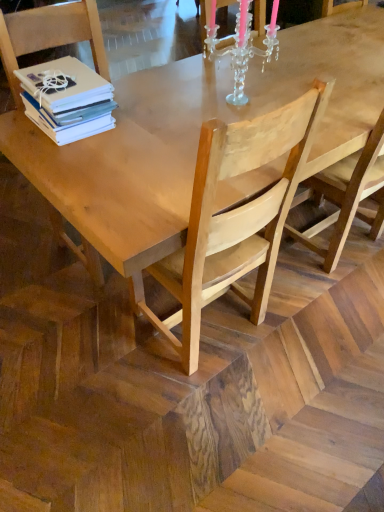
The image size is (384, 512). What do you see at coordinates (236, 216) in the screenshot? I see `light brown wooden chair at center, acting as the 2th chair starting from the left` at bounding box center [236, 216].

What are the coordinates of `light brown wooden chair at center, acting as the 2th chair starting from the left` in the screenshot? It's located at (236, 216).

Measure the distance between point (x=84, y=35) and camera.

They are 1.76 meters apart.

Measure the distance between point (243, 63) and camera.

The depth of point (243, 63) is 6.15 feet.

What is the approximate height of clear crystal candle holder at upper center?

clear crystal candle holder at upper center is 15.81 inches in height.

Where is `light brown wooden chair at center, acting as the 2th chair starting from the left`? light brown wooden chair at center, acting as the 2th chair starting from the left is located at coordinates (236, 216).

Considering the sizes of objects clear crystal candle holder at upper center and light brown wood chair at left, arranged as the 1th chair when viewed from the left, in the image provided, who is smaller, clear crystal candle holder at upper center or light brown wood chair at left, arranged as the 1th chair when viewed from the left,?

clear crystal candle holder at upper center is smaller.

What's the angular difference between clear crystal candle holder at upper center and light brown wood chair at left, which ranks as the 2th chair in right-to-left order,'s facing directions?

The facing directions of clear crystal candle holder at upper center and light brown wood chair at left, which ranks as the 2th chair in right-to-left order, are 178 degrees apart.

Between clear crystal candle holder at upper center and light brown wood chair at left, which ranks as the 2th chair in right-to-left order, which one has smaller width?

With smaller width is clear crystal candle holder at upper center.

Which is closer, [265,59] or [26,36]?

Clearly, point [265,59] is more distant from the camera than point [26,36].

Which point is more distant from viewer, (34,14) or (70,72)?

The point (34,14) is more distant.

Which of these two, light brown wood chair at left, arranged as the 1th chair when viewed from the left, or white matte stack of books at upper left, is smaller?

With smaller size is white matte stack of books at upper left.

Are light brown wood chair at left, arranged as the 1th chair when viewed from the left, and white matte stack of books at upper left located far from each other?

No, light brown wood chair at left, arranged as the 1th chair when viewed from the left, is not far away from white matte stack of books at upper left.

Is clear crystal candle holder at upper center shorter than light brown wooden chair at center, the 1th chair positioned from the right?

Yes, clear crystal candle holder at upper center is shorter than light brown wooden chair at center, the 1th chair positioned from the right.

Who is bigger, clear crystal candle holder at upper center or light brown wooden chair at center, acting as the 2th chair starting from the left?

Bigger between the two is light brown wooden chair at center, acting as the 2th chair starting from the left.

Which is farther, (277, 54) or (195, 207)?

The point (277, 54) is farther.

Is clear crystal candle holder at upper center oriented away from light brown wooden chair at center, the 1th chair positioned from the right?

No, clear crystal candle holder at upper center is not facing away from light brown wooden chair at center, the 1th chair positioned from the right.

Based on the photo, between white matte stack of books at upper left and light brown wood chair at left, which ranks as the 2th chair in right-to-left order, which one is positioned behind?

white matte stack of books at upper left is further away from the camera.

From a real-world perspective, is white matte stack of books at upper left positioned above or below light brown wood chair at left, arranged as the 1th chair when viewed from the left?

In terms of real-world spatial position, white matte stack of books at upper left is above light brown wood chair at left, arranged as the 1th chair when viewed from the left.

From the picture: Is white matte stack of books at upper left to the left or to the right of light brown wood chair at left, which ranks as the 2th chair in right-to-left order, in the image?

In the image, white matte stack of books at upper left appears on the left side of light brown wood chair at left, which ranks as the 2th chair in right-to-left order.

Considering the relative sizes of white matte stack of books at upper left and light brown wood chair at left, arranged as the 1th chair when viewed from the left, in the image provided, is white matte stack of books at upper left wider than light brown wood chair at left, arranged as the 1th chair when viewed from the left,?

Incorrect, the width of white matte stack of books at upper left does not surpass that of light brown wood chair at left, arranged as the 1th chair when viewed from the left.

Is point (100, 276) farther from camera compared to point (195, 309)?

Yes, it is.

The image size is (384, 512). Find the location of `chair located above the light brown wooden chair at center, the 1th chair positioned from the right (from a real-world perspective)`. chair located above the light brown wooden chair at center, the 1th chair positioned from the right (from a real-world perspective) is located at coordinates pos(50,36).

Considering the sizes of objects light brown wood chair at left, arranged as the 1th chair when viewed from the left, and light brown wooden chair at center, the 1th chair positioned from the right, in the image provided, who is taller, light brown wood chair at left, arranged as the 1th chair when viewed from the left, or light brown wooden chair at center, the 1th chair positioned from the right,?

light brown wood chair at left, arranged as the 1th chair when viewed from the left.

Which is more to the left, light brown wood chair at left, which ranks as the 2th chair in right-to-left order, or light brown wooden chair at center, the 1th chair positioned from the right?

light brown wood chair at left, which ranks as the 2th chair in right-to-left order.

Which is further, (64, 87) or (213, 281)?

The point (64, 87) is farther.

Is white matte stack of books at upper left directly adjacent to light brown wooden chair at center, the 1th chair positioned from the right?

They are not placed beside each other.

Does white matte stack of books at upper left have a smaller size compared to light brown wooden chair at center, acting as the 2th chair starting from the left?

Correct, white matte stack of books at upper left occupies less space than light brown wooden chair at center, acting as the 2th chair starting from the left.

Does white matte stack of books at upper left contain light brown wooden chair at center, the 1th chair positioned from the right?

No, white matte stack of books at upper left does not contain light brown wooden chair at center, the 1th chair positioned from the right.

Where is `chair that is the 2nd object located below the clear crystal candle holder at upper center (from the image's perspective)`? The width and height of the screenshot is (384, 512). chair that is the 2nd object located below the clear crystal candle holder at upper center (from the image's perspective) is located at coordinates (236, 216).

Looking at this image, considering the sizes of objects light brown wooden chair at center, acting as the 2th chair starting from the left, and clear crystal candle holder at upper center in the image provided, who is shorter, light brown wooden chair at center, acting as the 2th chair starting from the left, or clear crystal candle holder at upper center?

clear crystal candle holder at upper center is shorter.

How many degrees apart are the facing directions of light brown wooden chair at center, the 1th chair positioned from the right, and clear crystal candle holder at upper center?

The angle between the facing direction of light brown wooden chair at center, the 1th chair positioned from the right, and the facing direction of clear crystal candle holder at upper center is 4.32 degrees.

Measure the distance between light brown wooden chair at center, acting as the 2th chair starting from the left, and clear crystal candle holder at upper center.

The distance of light brown wooden chair at center, acting as the 2th chair starting from the left, from clear crystal candle holder at upper center is 29.73 inches.

The width and height of the screenshot is (384, 512). What are the coordinates of `candle holder behind the light brown wood chair at left, which ranks as the 2th chair in right-to-left order` in the screenshot? It's located at (241, 46).

Where is `the 1st chair below the white matte stack of books at upper left (from the image's perspective)`? The width and height of the screenshot is (384, 512). the 1st chair below the white matte stack of books at upper left (from the image's perspective) is located at coordinates (50, 36).

Based on the photo, estimate the real-world distances between objects in this image. Which object is further from clear crystal candle holder at upper center, white matte stack of books at upper left or light brown wood chair at left, arranged as the 1th chair when viewed from the left?

white matte stack of books at upper left is positioned further to the anchor clear crystal candle holder at upper center.

Estimate the real-world distances between objects in this image. Which object is further from white matte stack of books at upper left, light brown wooden chair at center, acting as the 2th chair starting from the left, or light brown wood chair at left, which ranks as the 2th chair in right-to-left order?

The object further to white matte stack of books at upper left is light brown wooden chair at center, acting as the 2th chair starting from the left.

Considering their positions, is white matte stack of books at upper left positioned further to light brown wooden chair at center, the 1th chair positioned from the right, than clear crystal candle holder at upper center?

Among the two, clear crystal candle holder at upper center is located further to light brown wooden chair at center, the 1th chair positioned from the right.

Based on their spatial positions, is light brown wooden chair at center, the 1th chair positioned from the right, or clear crystal candle holder at upper center closer to white matte stack of books at upper left?

Based on the image, clear crystal candle holder at upper center appears to be nearer to white matte stack of books at upper left.

From the image, which object appears to be nearer to white matte stack of books at upper left, light brown wood chair at left, arranged as the 1th chair when viewed from the left, or light brown wooden chair at center, acting as the 2th chair starting from the left?

Among the two, light brown wood chair at left, arranged as the 1th chair when viewed from the left, is located nearer to white matte stack of books at upper left.

Considering their positions, is light brown wooden chair at center, acting as the 2th chair starting from the left, positioned closer to light brown wood chair at left, arranged as the 1th chair when viewed from the left, than clear crystal candle holder at upper center?

clear crystal candle holder at upper center.

When comparing their distances from light brown wood chair at left, which ranks as the 2th chair in right-to-left order, does white matte stack of books at upper left or light brown wooden chair at center, acting as the 2th chair starting from the left, seem further?

light brown wooden chair at center, acting as the 2th chair starting from the left.

From the image, which object appears to be farther from light brown wooden chair at center, acting as the 2th chair starting from the left, white matte stack of books at upper left or light brown wood chair at left, which ranks as the 2th chair in right-to-left order?

light brown wood chair at left, which ranks as the 2th chair in right-to-left order.

What are the coordinates of `chair located between white matte stack of books at upper left and light brown wooden chair at center, acting as the 2th chair starting from the left, in the left-right direction` in the screenshot? It's located at (50, 36).

Where is `book between clear crystal candle holder at upper center and light brown wooden chair at center, the 1th chair positioned from the right, vertically`? book between clear crystal candle holder at upper center and light brown wooden chair at center, the 1th chair positioned from the right, vertically is located at coordinates (67, 99).

Where is `chair that lies between clear crystal candle holder at upper center and light brown wooden chair at center, acting as the 2th chair starting from the left, from top to bottom`? The width and height of the screenshot is (384, 512). chair that lies between clear crystal candle holder at upper center and light brown wooden chair at center, acting as the 2th chair starting from the left, from top to bottom is located at coordinates (50, 36).